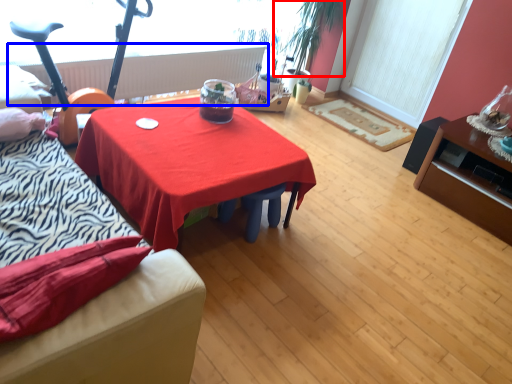
Question: Which object appears farthest to the camera in this image, plant (highlighted by a red box) or radiator (highlighted by a blue box)?

Choices:
 (A) plant
 (B) radiator

Answer: (A)